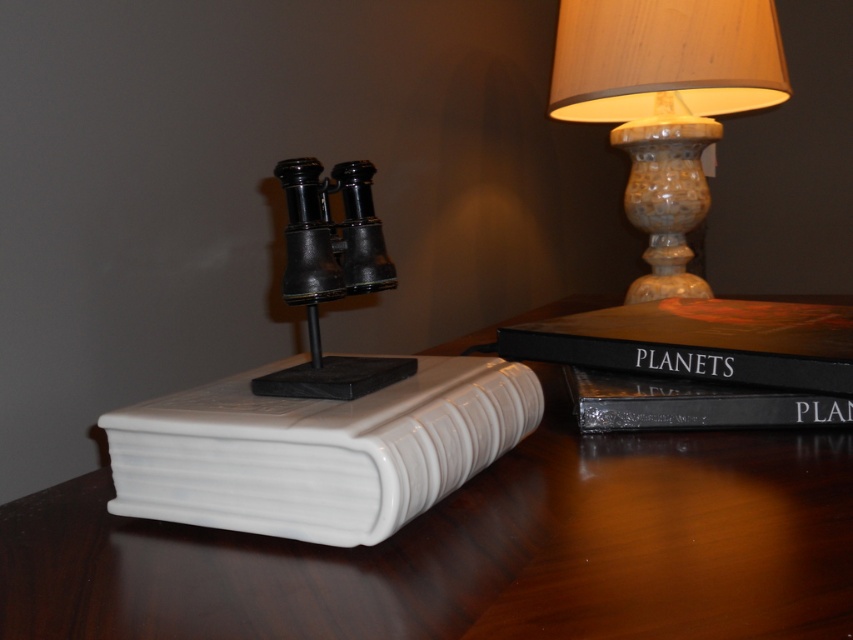
Question: Which object is positioned farthest from the white glossy book at center?

Choices:
 (A) black matte/finish binoculars at center
 (B) hardcover book at right
 (C) white glossy book at left
 (D) matte beige lampshade at upper right

Answer: (D)

Question: Does white glossy book at center appear over matte beige lampshade at upper right?

Choices:
 (A) no
 (B) yes

Answer: (A)

Question: Can you confirm if white glossy book at left is thinner than black matte book at upper right?

Choices:
 (A) no
 (B) yes

Answer: (A)

Question: Which point is farther to the camera?

Choices:
 (A) hardcover book at right
 (B) black matte/finish binoculars at center
 (C) white glossy book at center
 (D) matte beige lampshade at upper right

Answer: (D)

Question: Among these objects, which one is nearest to the camera?

Choices:
 (A) white glossy book at center
 (B) black matte book at upper right
 (C) hardcover book at right
 (D) white glossy book at left

Answer: (D)

Question: Does black matte book at upper right have a larger size compared to black matte/finish binoculars at center?

Choices:
 (A) no
 (B) yes

Answer: (B)